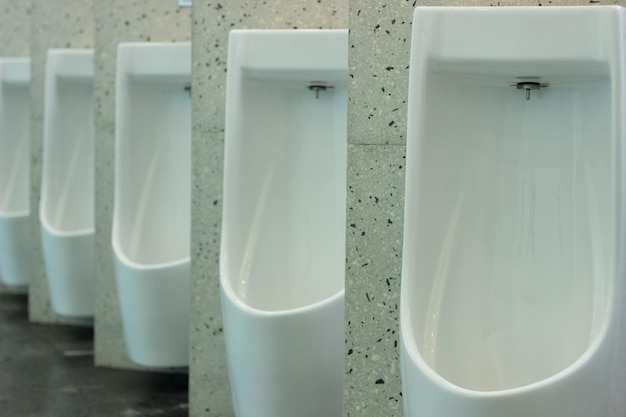
Identify the location of urinals. This screenshot has width=626, height=417. (12, 117), (64, 210), (154, 271), (262, 293), (468, 301).